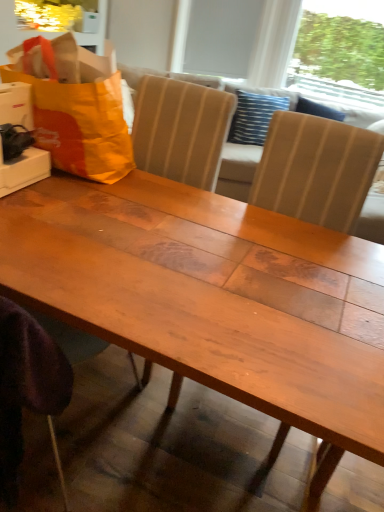
Image resolution: width=384 pixels, height=512 pixels. In order to click on white matte window screen at upper center, which is the second window screen in right-to-left order in this screenshot , I will do `click(221, 36)`.

This screenshot has width=384, height=512. What do you see at coordinates (340, 54) in the screenshot?
I see `transparent plastic window screen at upper right, which is counted as the 2th window screen, starting from the left` at bounding box center [340, 54].

This screenshot has width=384, height=512. I want to click on white matte window screen at upper center, the 1th window screen in the left-to-right sequence, so click(x=221, y=36).

Considering the positions of points (198, 68) and (31, 57), is point (198, 68) farther from camera compared to point (31, 57)?

That is True.

Could you tell me if white matte window screen at upper center, the 1th window screen in the left-to-right sequence, is turned towards orange fabric grocery bag at upper left?

No, white matte window screen at upper center, the 1th window screen in the left-to-right sequence, is not turned towards orange fabric grocery bag at upper left.

Looking at this image, from a real-world perspective, does wooden table at center sit lower than orange fabric grocery bag at upper left?

Yes.

What's the angular difference between wooden table at center and orange fabric grocery bag at upper left's facing directions?

There is a 8.18-degree angle between the facing directions of wooden table at center and orange fabric grocery bag at upper left.

Is wooden table at center far from orange fabric grocery bag at upper left?

No, wooden table at center is not far away from orange fabric grocery bag at upper left.

In terms of size, does wooden table at center appear bigger or smaller than orange fabric grocery bag at upper left?

In the image, wooden table at center appears to be smaller than orange fabric grocery bag at upper left.

Considering the relative positions of wooden table at center and blue striped pillow at upper center in the image provided, is wooden table at center to the left of blue striped pillow at upper center from the viewer's perspective?

Correct, you'll find wooden table at center to the left of blue striped pillow at upper center.

Which object is more forward, wooden table at center or blue striped pillow at upper center?

wooden table at center.

Considering the sizes of wooden table at center and blue striped pillow at upper center in the image, is wooden table at center bigger or smaller than blue striped pillow at upper center?

Considering their sizes, wooden table at center takes up more space than blue striped pillow at upper center.

Considering the points (296, 286) and (254, 109), which point is in front, point (296, 286) or point (254, 109)?

The point (296, 286) is closer.

From the image's perspective, is transparent plastic window screen at upper right, which ranks as the first window screen in right-to-left order, located beneath orange fabric grocery bag at upper left?

No, from the image's perspective, transparent plastic window screen at upper right, which ranks as the first window screen in right-to-left order, is not beneath orange fabric grocery bag at upper left.

Find the location of a particular element. Image resolution: width=384 pixels, height=512 pixels. grocery bag that appears in front of the transparent plastic window screen at upper right, which ranks as the first window screen in right-to-left order is located at coordinates (75, 106).

Which object is thinner, transparent plastic window screen at upper right, which is counted as the 2th window screen, starting from the left, or orange fabric grocery bag at upper left?

Thinner between the two is transparent plastic window screen at upper right, which is counted as the 2th window screen, starting from the left.

Which is nearer, (341,46) or (71,134)?

The point (71,134) is closer.

Which object is closer to the camera taking this photo, white matte window screen at upper center, which is the second window screen in right-to-left order, or blue striped pillow at upper center?

blue striped pillow at upper center.

From their relative heights in the image, would you say white matte window screen at upper center, the 1th window screen in the left-to-right sequence, is taller or shorter than blue striped pillow at upper center?

Answer: In the image, white matte window screen at upper center, the 1th window screen in the left-to-right sequence, appears to be taller than blue striped pillow at upper center.

I want to click on window screen that is the 2nd one when counting backward from the blue striped pillow at upper center, so click(x=221, y=36).

Are white matte window screen at upper center, which is the second window screen in right-to-left order, and blue striped pillow at upper center far apart?

That's not correct — white matte window screen at upper center, which is the second window screen in right-to-left order, is a little close to blue striped pillow at upper center.

From the picture: Considering the relative sizes of orange fabric grocery bag at upper left and transparent plastic window screen at upper right, which is counted as the 2th window screen, starting from the left, in the image provided, is orange fabric grocery bag at upper left taller than transparent plastic window screen at upper right, which is counted as the 2th window screen, starting from the left,?

Incorrect, the height of orange fabric grocery bag at upper left is not larger of that of transparent plastic window screen at upper right, which is counted as the 2th window screen, starting from the left.

Considering the positions of objects orange fabric grocery bag at upper left and transparent plastic window screen at upper right, which is counted as the 2th window screen, starting from the left, in the image provided, who is more to the left, orange fabric grocery bag at upper left or transparent plastic window screen at upper right, which is counted as the 2th window screen, starting from the left,?

From the viewer's perspective, orange fabric grocery bag at upper left appears more on the left side.

Considering the sizes of objects orange fabric grocery bag at upper left and transparent plastic window screen at upper right, which ranks as the first window screen in right-to-left order, in the image provided, who is bigger, orange fabric grocery bag at upper left or transparent plastic window screen at upper right, which ranks as the first window screen in right-to-left order,?

transparent plastic window screen at upper right, which ranks as the first window screen in right-to-left order, is bigger.

From a real-world perspective, who is located lower, orange fabric grocery bag at upper left or transparent plastic window screen at upper right, which is counted as the 2th window screen, starting from the left?

orange fabric grocery bag at upper left, from a real-world perspective.

Which object is more forward, transparent plastic window screen at upper right, which is counted as the 2th window screen, starting from the left, or wooden table at center?

wooden table at center is more forward.

Does transparent plastic window screen at upper right, which is counted as the 2th window screen, starting from the left, have a greater width compared to wooden table at center?

In fact, transparent plastic window screen at upper right, which is counted as the 2th window screen, starting from the left, might be narrower than wooden table at center.

Is transparent plastic window screen at upper right, which ranks as the first window screen in right-to-left order, not close to wooden table at center?

Yes, transparent plastic window screen at upper right, which ranks as the first window screen in right-to-left order, is far from wooden table at center.

Where is `the 2nd window screen behind the orange fabric grocery bag at upper left, counting from the anchor's position`? This screenshot has height=512, width=384. the 2nd window screen behind the orange fabric grocery bag at upper left, counting from the anchor's position is located at coordinates (221, 36).

Locate an element on the screen. grocery bag that is above the wooden table at center (from the image's perspective) is located at coordinates (75, 106).

Looking at the image, which one is located closer to white matte window screen at upper center, the 1th window screen in the left-to-right sequence, orange fabric grocery bag at upper left or wooden table at center?

orange fabric grocery bag at upper left is positioned closer to the anchor white matte window screen at upper center, the 1th window screen in the left-to-right sequence.

Based on their spatial positions, is orange fabric grocery bag at upper left or white matte window screen at upper center, which is the second window screen in right-to-left order, closer to transparent plastic window screen at upper right, which is counted as the 2th window screen, starting from the left?

Among the two, white matte window screen at upper center, which is the second window screen in right-to-left order, is located nearer to transparent plastic window screen at upper right, which is counted as the 2th window screen, starting from the left.

Which object lies nearer to the anchor point transparent plastic window screen at upper right, which ranks as the first window screen in right-to-left order, white matte window screen at upper center, which is the second window screen in right-to-left order, or wooden table at center?

white matte window screen at upper center, which is the second window screen in right-to-left order, is positioned closer to the anchor transparent plastic window screen at upper right, which ranks as the first window screen in right-to-left order.

Estimate the real-world distances between objects in this image. Which object is closer to wooden table at center, orange fabric grocery bag at upper left or blue striped pillow at upper center?

orange fabric grocery bag at upper left is closer to wooden table at center.

Considering their positions, is transparent plastic window screen at upper right, which ranks as the first window screen in right-to-left order, positioned closer to blue striped pillow at upper center than orange fabric grocery bag at upper left?

Among the two, orange fabric grocery bag at upper left is located nearer to blue striped pillow at upper center.

Estimate the real-world distances between objects in this image. Which object is further from transparent plastic window screen at upper right, which is counted as the 2th window screen, starting from the left, blue striped pillow at upper center or orange fabric grocery bag at upper left?

The object further to transparent plastic window screen at upper right, which is counted as the 2th window screen, starting from the left, is orange fabric grocery bag at upper left.

Looking at the image, which one is located further to wooden table at center, transparent plastic window screen at upper right, which is counted as the 2th window screen, starting from the left, or orange fabric grocery bag at upper left?

transparent plastic window screen at upper right, which is counted as the 2th window screen, starting from the left, is further to wooden table at center.

Based on their spatial positions, is wooden table at center or transparent plastic window screen at upper right, which is counted as the 2th window screen, starting from the left, closer to white matte window screen at upper center, the 1th window screen in the left-to-right sequence?

Among the two, transparent plastic window screen at upper right, which is counted as the 2th window screen, starting from the left, is located nearer to white matte window screen at upper center, the 1th window screen in the left-to-right sequence.

Image resolution: width=384 pixels, height=512 pixels. I want to click on grocery bag between wooden table at center and blue striped pillow at upper center in the front-back direction, so click(75, 106).

Find the location of `grocery bag between wooden table at center and transparent plastic window screen at upper right, which ranks as the first window screen in right-to-left order, in the front-back direction`. grocery bag between wooden table at center and transparent plastic window screen at upper right, which ranks as the first window screen in right-to-left order, in the front-back direction is located at coordinates (75, 106).

In order to click on pillow positioned between wooden table at center and transparent plastic window screen at upper right, which is counted as the 2th window screen, starting from the left, from near to far in this screenshot , I will do `click(254, 116)`.

Locate an element on the screen. The width and height of the screenshot is (384, 512). window screen located between orange fabric grocery bag at upper left and white matte window screen at upper center, the 1th window screen in the left-to-right sequence, in the depth direction is located at coordinates (340, 54).